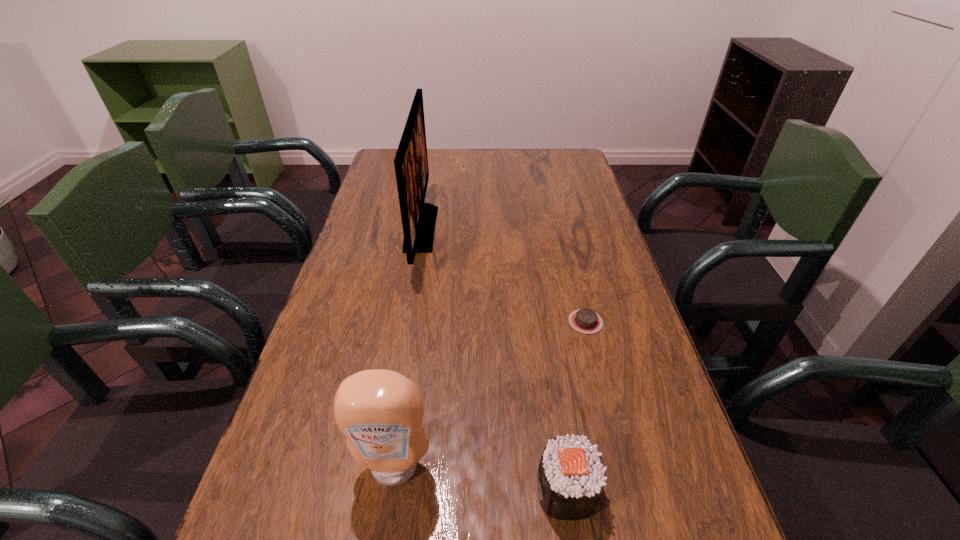
Identify the location of free location located 0.260m on the front of the chocolate cake. The height and width of the screenshot is (540, 960). (614, 438).

Where is `object located in the left edge section of the desktop`? object located in the left edge section of the desktop is located at coordinates (418, 218).

Where is `object at the right edge`? This screenshot has width=960, height=540. object at the right edge is located at coordinates (583, 320).

Locate an element on the screen. vacant area at the far edge of the desktop is located at coordinates (445, 153).

This screenshot has height=540, width=960. Identify the location of free space at the left edge of the desktop. (297, 415).

At what (x,y) coordinates should I click in order to perform the action: click on blank area at the right edge. Please return your answer as a coordinate pair (x, y). This screenshot has width=960, height=540. Looking at the image, I should click on (641, 443).

Where is `vacant space at the far left corner`? This screenshot has height=540, width=960. vacant space at the far left corner is located at coordinates (380, 173).

Find the location of a particular element. empty space between the shortest object and the condiment is located at coordinates (490, 395).

This screenshot has width=960, height=540. In order to click on empty location between the condiment and the monitor in this screenshot , I will do `click(408, 348)`.

Find the location of a particular element. The width and height of the screenshot is (960, 540). empty location between the chocolate cake and the third object from left to right is located at coordinates (576, 406).